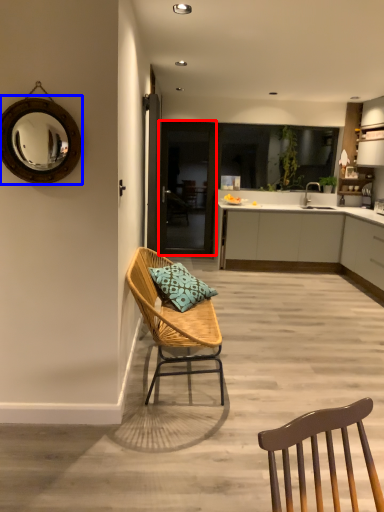
Question: Which point is closer to the camera, glass door (highlighted by a red box) or mirror (highlighted by a blue box)?

Choices:
 (A) glass door
 (B) mirror

Answer: (B)